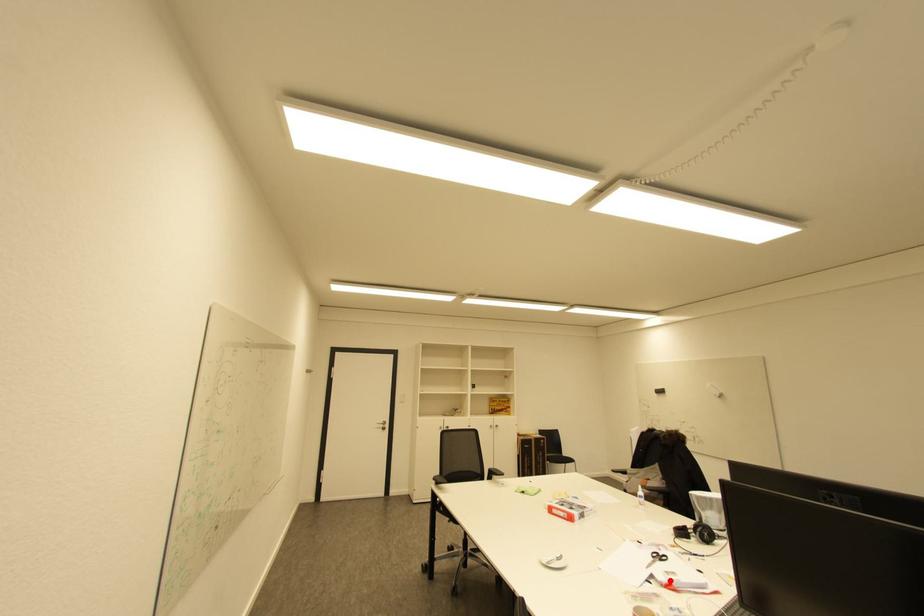
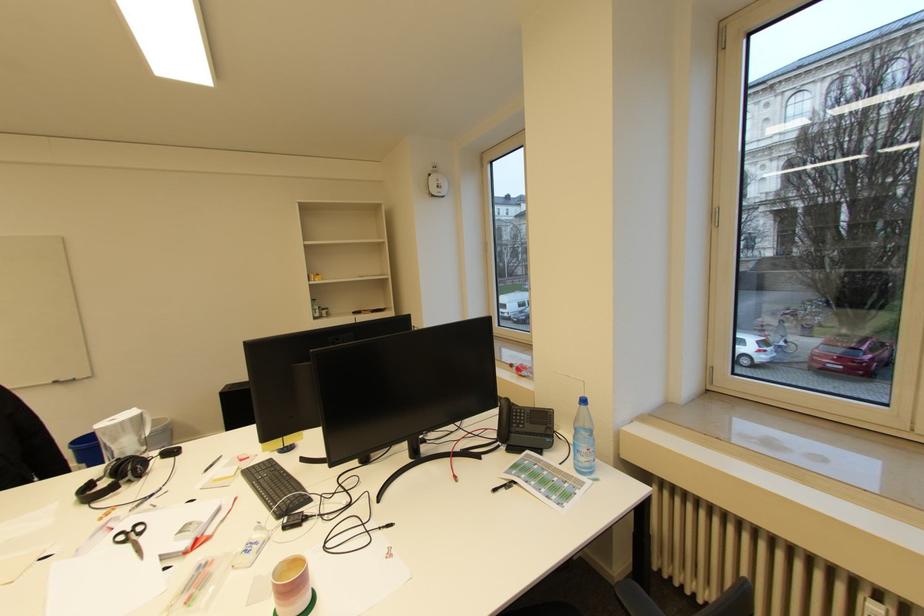
Find the pixel in the second image that matches the highlighted location in the first image.

(192, 544)